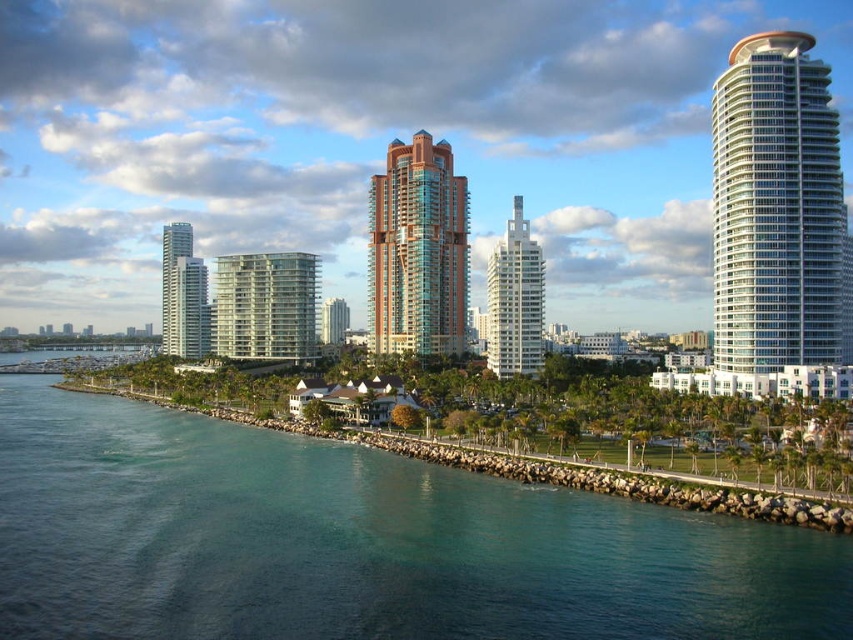
You are a drone operator tasked with capturing aerial footage of the teal glass tower at center and the clear glass building at center. Your drone has a maximum flight range of 30 meters. Can you fly the drone from one building to the other without exceeding its range?

The distance between the teal glass tower at center and the clear glass building at center is 30.77 meters, which exceeds the drone operator maximum flight range of 30 meters. Therefore, the drone cannot fly from one building to the other without exceeding its range.

You are a drone operator who needs to fly a drone between the white glassy tower at right and the glassy white skyscraper at left. The drone has a maximum flight distance of 150 meters. Can the drone safely fly between them without exceeding its range?

The white glassy tower at right and glassy white skyscraper at left are 151.32 meters apart. Since the drone can only fly up to 150 meters, it cannot safely traverse the distance between them without exceeding its range.